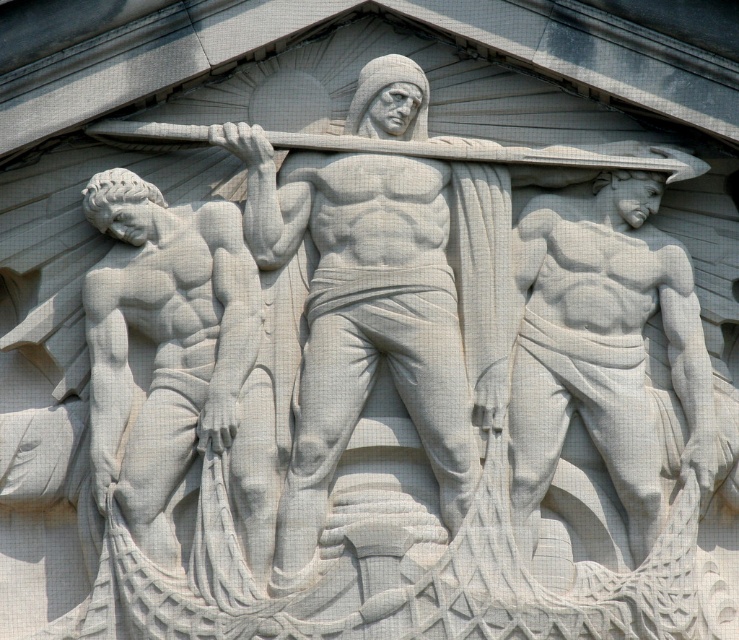
You are a tour guide explaining the layout of the stone relief sculpture. You want to mention the distance between the smooth white statue at left and the matte white statue at right. How far apart are they?

The smooth white statue at left and the matte white statue at right are 9.61 meters apart.

Based on the scene described, which statue, the smooth white statue at left or the matte white statue at right, takes up more space in the relief sculpture?

The matte white statue at right takes up more space in the relief sculpture because it occupies more space than the smooth white statue at left.

You are an archaeologist examining the stone relief sculpture. You notice two points marked on the image. The first point is at coordinates point (171, 259) and the second is at point (551, 349). From your vantage point, which point is closer to you?

Point (171, 259) is in front of point (551, 349), so the first point is closer to you.